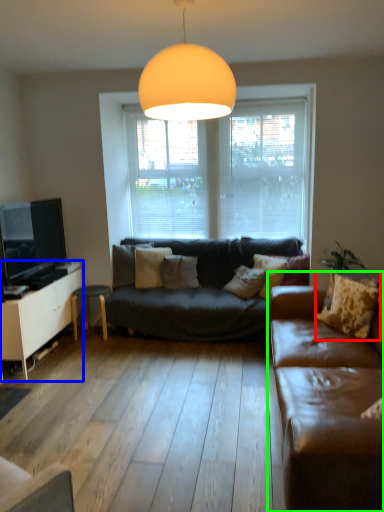
Question: Which is nearer to the pillow (highlighted by a red box)? cabinetry (highlighted by a blue box) or studio couch (highlighted by a green box).

Choices:
 (A) cabinetry
 (B) studio couch

Answer: (B)